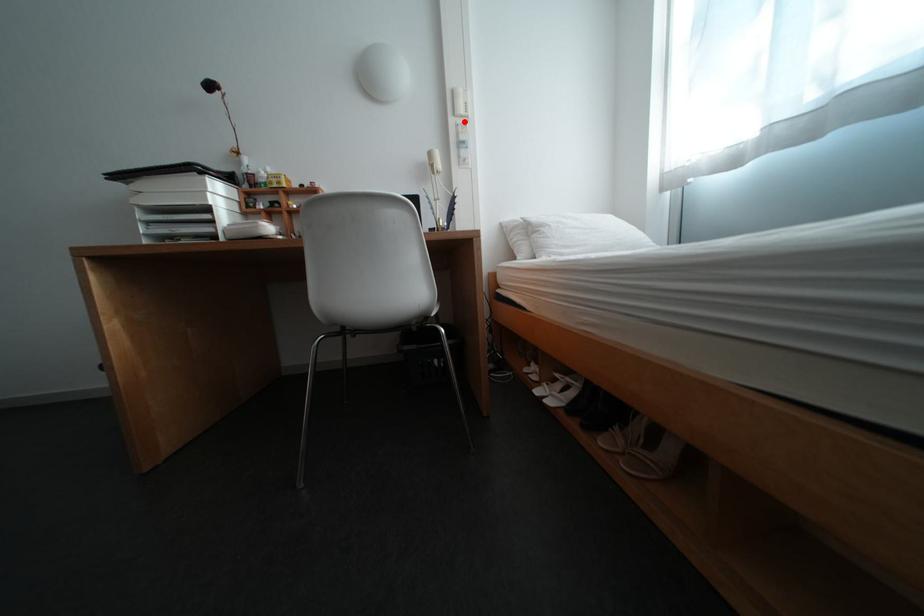
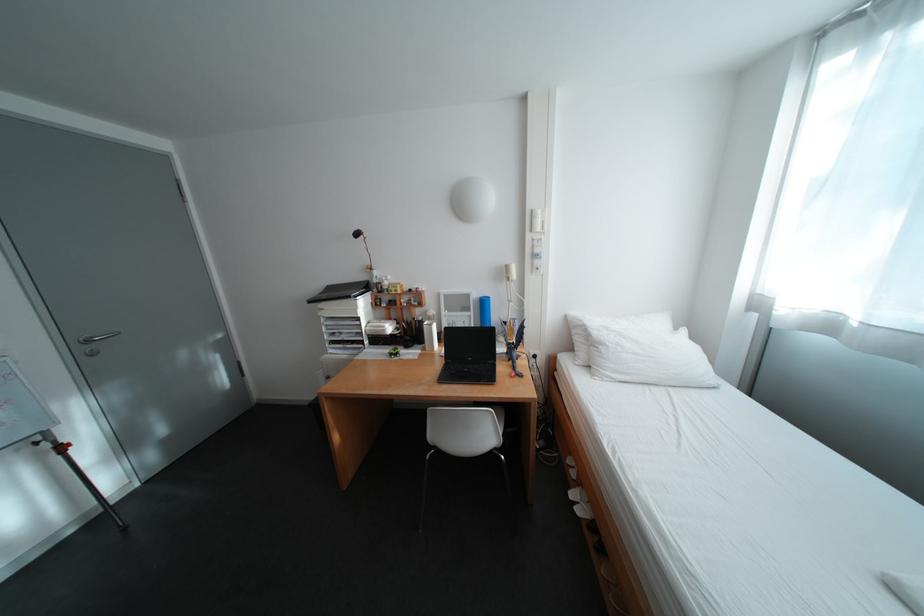
In the second image, find the point that corresponds to the highlighted location in the first image.

(541, 237)